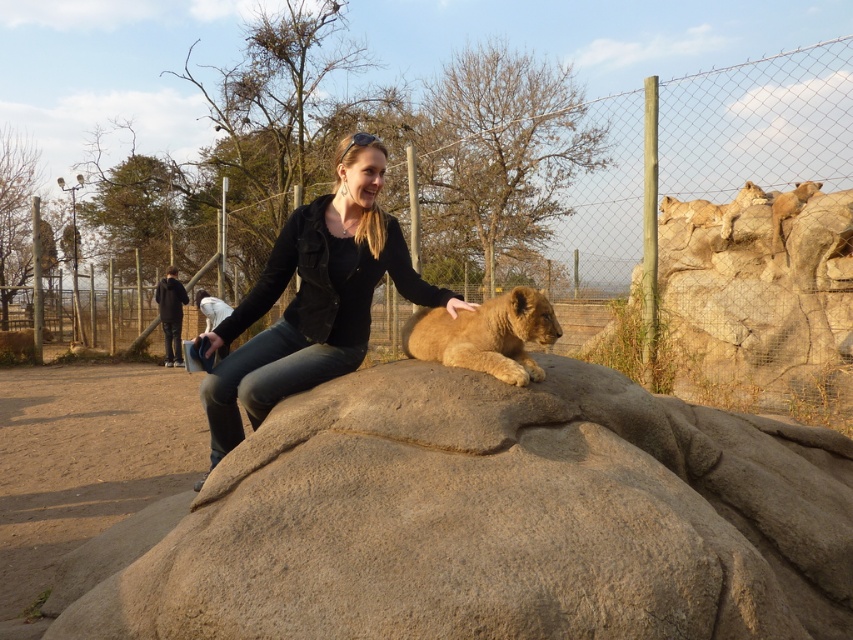
Does smooth sandstone boulder at center appear on the right side of black leather jacket at center?

Indeed, smooth sandstone boulder at center is positioned on the right side of black leather jacket at center.

Between smooth sandstone boulder at center and black leather jacket at center, which one is positioned lower?

smooth sandstone boulder at center

Does point (503, 486) come behind point (424, 289)?

No.

The image size is (853, 640). In order to click on smooth sandstone boulder at center in this screenshot , I will do `click(488, 518)`.

Does black leather jacket at center have a greater width compared to golden fur lion cub at center?

Yes, black leather jacket at center is wider than golden fur lion cub at center.

Does black leather jacket at center have a greater height compared to golden fur lion cub at center?

Yes.

Does point (404, 256) come closer to viewer compared to point (520, 385)?

No, it is not.

Identify the location of black leather jacket at center. (312, 298).

Which is more to the left, smooth sandstone boulder at center or golden fur lion at upper right?

Positioned to the left is smooth sandstone boulder at center.

From the picture: Does smooth sandstone boulder at center have a greater width compared to golden fur lion at upper right?

→ Indeed, smooth sandstone boulder at center has a greater width compared to golden fur lion at upper right.

Does point (231, 609) lie behind point (718, 209)?

No, (231, 609) is in front of (718, 209).

Find the location of a particular element. This screenshot has width=853, height=640. smooth sandstone boulder at center is located at coordinates (x=488, y=518).